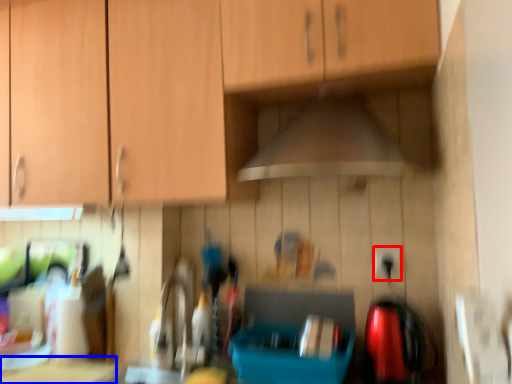
Question: Which object appears closest to the camera in this image, electric outlet (highlighted by a red box) or counter top (highlighted by a blue box)?

Choices:
 (A) electric outlet
 (B) counter top

Answer: (B)